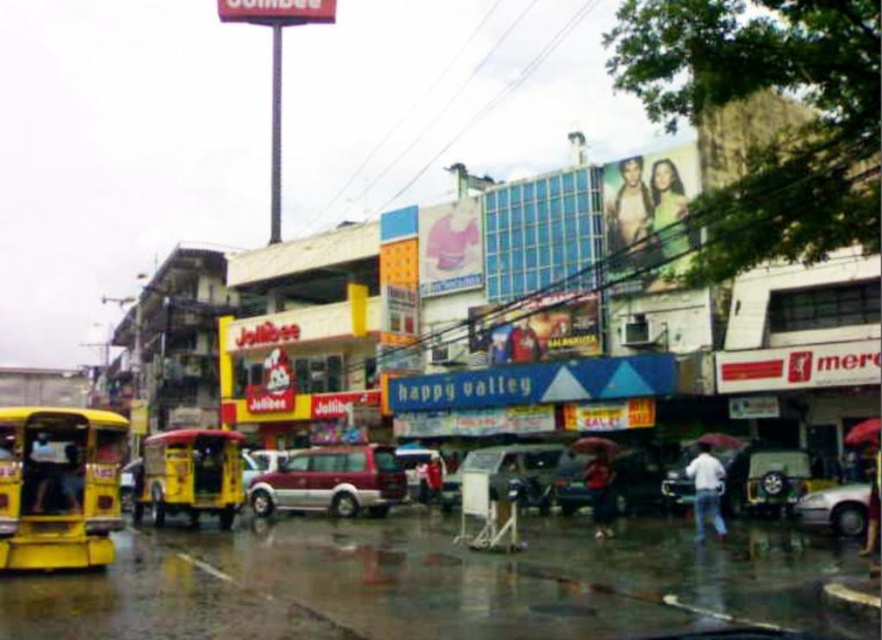
Question: Which of these objects is positioned farthest from the red fabric umbrella at center?

Choices:
 (A) white plastic bus stop at center
 (B) skinny jeans at upper center

Answer: (B)

Question: Can you confirm if maroon metallic van at center is bigger than dark blue jeans at lower right?

Choices:
 (A) no
 (B) yes

Answer: (B)

Question: Does green fabric person at upper right have a greater width compared to transparent red umbrella at lower right?

Choices:
 (A) no
 (B) yes

Answer: (A)

Question: Is white plastic bus stop at center closer to camera compared to silver metallic sedan at lower right?

Choices:
 (A) no
 (B) yes

Answer: (A)

Question: Considering the real-world distances, which object is farthest from the yellow matte bus at center?

Choices:
 (A) silver metallic sedan at lower right
 (B) green fabric person at upper right
 (C) white matte shirt at lower right
 (D) skinny jeans at upper center

Answer: (A)

Question: Which of the following is the farthest from the observer?

Choices:
 (A) metallic yellow bus at lower left
 (B) metallic silver car at center
 (C) silver metallic sedan at lower right

Answer: (B)